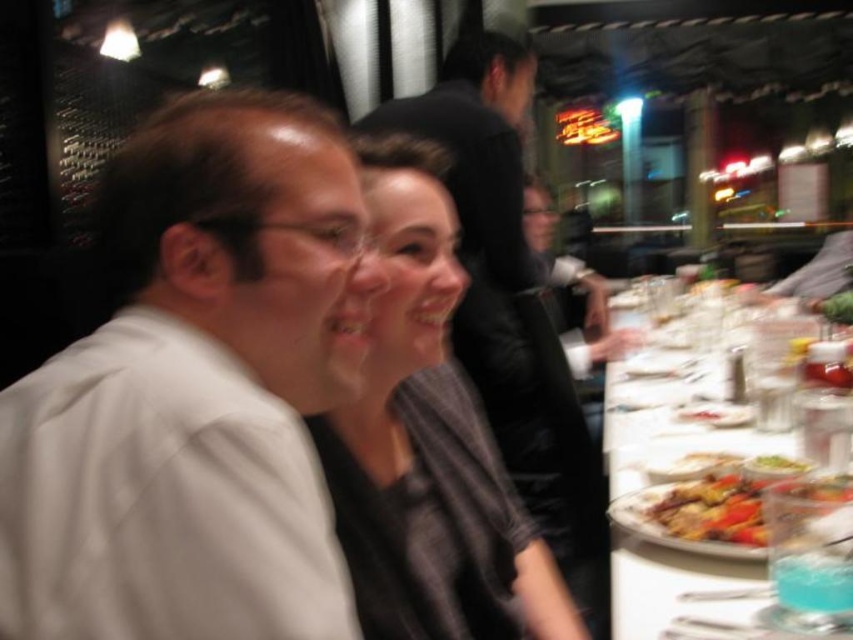
You are sitting at the table with two people. You need to place a napkin on the table. The napkin must be placed between the two points labeled point (407, 602) and point (701, 538). Based on their positions, where should you place the napkin relative to these points?

The napkin should be placed between point (407, 602) and point (701, 538), closer to point (407, 602) since it is in front of point (701, 538).

You are a photographer standing behind the two people at the table. You want to take a photo of the matte black shirt at center and the golden brown crispy chicken at right such that both are fully visible. Given that your camera can only focus on objects above a certain height, which object might require you to adjust your focus settings?

The matte black shirt at center has a greater height compared to the golden brown crispy chicken at right, so the golden brown crispy chicken at right might be too low to be in focus and require adjustment.